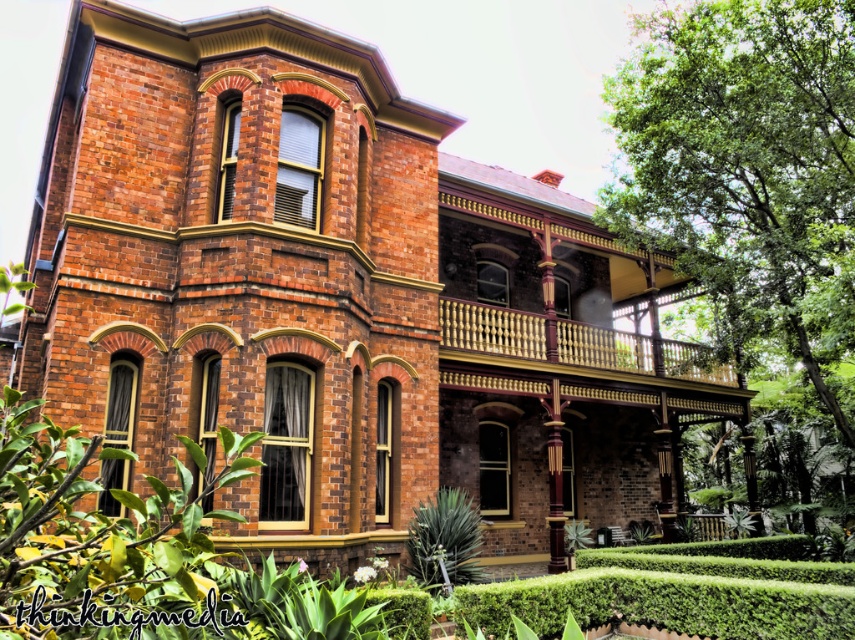
Question: Does green leafy tree at right appear on the right side of green leafy hedge at lower center?

Choices:
 (A) yes
 (B) no

Answer: (A)

Question: Which point appears farthest from the camera in this image?

Choices:
 (A) (447, 561)
 (B) (845, 337)

Answer: (B)

Question: Does green leafy tree at right appear over green leafy hedge at lower center?

Choices:
 (A) no
 (B) yes

Answer: (B)

Question: Does green leafy tree at right have a greater width compared to green leafy hedge at lower center?

Choices:
 (A) no
 (B) yes

Answer: (A)